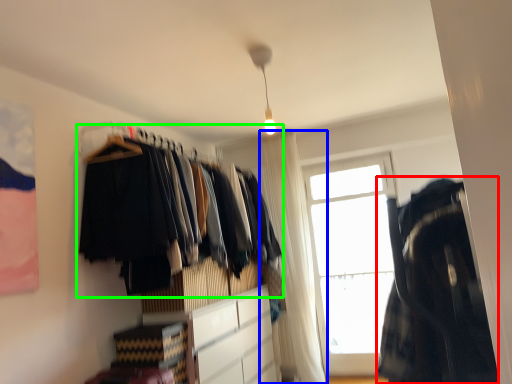
Question: Considering the real-world distances, which object is farthest from clothing (highlighted by a red box)? curtain (highlighted by a blue box) or closet (highlighted by a green box)?

Choices:
 (A) curtain
 (B) closet

Answer: (A)